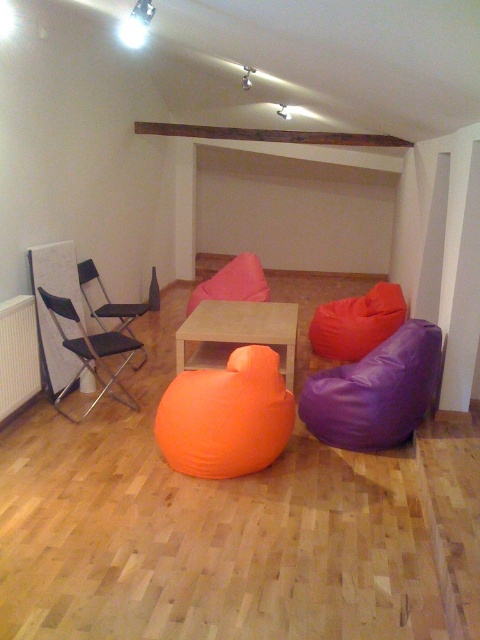
You are sitting on the orange fabric bean bag at center and want to move to the matte black folding chair at left. Which direction should you move to reach it?

The orange fabric bean bag at center is located below the matte black folding chair at left, so you should move upward to reach the matte black folding chair at left.

You are standing in the room and want to move from the point at coordinates (x=284, y=406) to the point at coordinates (x=17, y=404). Since you can only move forward, which direction should you face to reach your destination?

You should face downward because point (x=284, y=406) is closer to the viewer than point (x=17, y=404), so moving forward in that direction will take you toward the destination.

You are sitting on the orange fabric bean bag at center and want to reach the white matte radiator at left to adjust the temperature. Considering their heights, can you easily reach the controls on the radiator from your seated position?

The orange fabric bean bag at center is shorter than the white matte radiator at left, so you may need to stand up to reach the controls on the radiator since the radiator is taller than the bean bag.